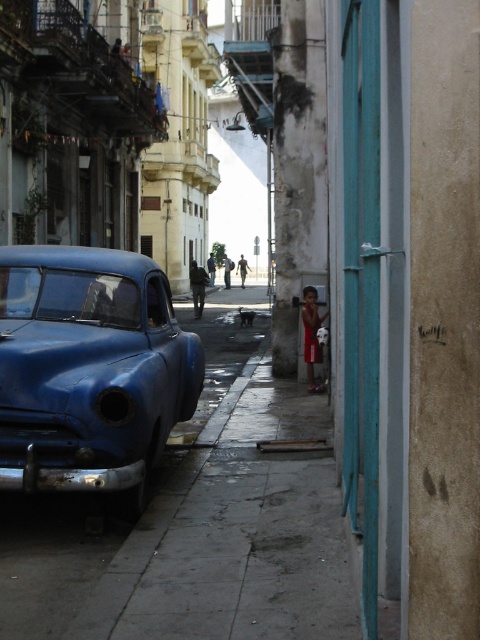
Question: Which point appears farthest from the camera in this image?

Choices:
 (A) (316, 316)
 (B) (24, 250)

Answer: (A)

Question: Is matte blue car at left thinner than red fabric shirt at lower right?

Choices:
 (A) no
 (B) yes

Answer: (A)

Question: Can you confirm if matte blue car at left is positioned to the left of red fabric shirt at lower right?

Choices:
 (A) yes
 (B) no

Answer: (A)

Question: Observing the image, what is the correct spatial positioning of matte blue car at left in reference to red fabric shirt at lower right?

Choices:
 (A) right
 (B) left

Answer: (B)

Question: Which of the following is the closest to the observer?

Choices:
 (A) red fabric shirt at lower right
 (B) matte blue car at left

Answer: (B)